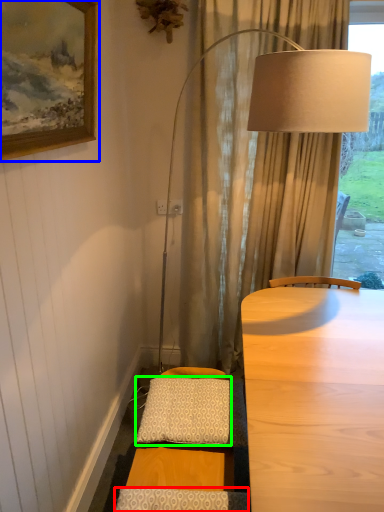
Question: Considering the real-world distances, which object is closest to pillow (highlighted by a red box)? picture frame (highlighted by a blue box) or pillow (highlighted by a green box).

Choices:
 (A) picture frame
 (B) pillow

Answer: (B)